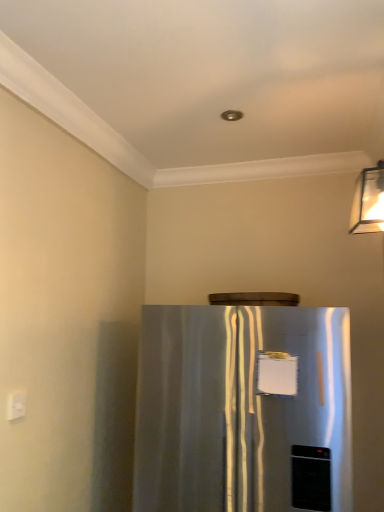
Question: Can you confirm if white plastic electric outlet at lower left is positioned to the left of satin silver refrigerator at center?

Choices:
 (A) no
 (B) yes

Answer: (B)

Question: Is white plastic electric outlet at lower left far from satin silver refrigerator at center?

Choices:
 (A) yes
 (B) no

Answer: (B)

Question: Considering the relative sizes of white plastic electric outlet at lower left and satin silver refrigerator at center in the image provided, is white plastic electric outlet at lower left bigger than satin silver refrigerator at center?

Choices:
 (A) yes
 (B) no

Answer: (B)

Question: Can we say white plastic electric outlet at lower left lies outside satin silver refrigerator at center?

Choices:
 (A) no
 (B) yes

Answer: (B)

Question: Is white plastic electric outlet at lower left shorter than satin silver refrigerator at center?

Choices:
 (A) no
 (B) yes

Answer: (B)

Question: Is satin silver refrigerator at center at the back of white plastic electric outlet at lower left?

Choices:
 (A) yes
 (B) no

Answer: (B)

Question: Does satin silver refrigerator at center touch white plastic electric outlet at lower left?

Choices:
 (A) yes
 (B) no

Answer: (B)

Question: Does satin silver refrigerator at center have a lesser width compared to white plastic electric outlet at lower left?

Choices:
 (A) yes
 (B) no

Answer: (B)

Question: Would you say satin silver refrigerator at center is outside white plastic electric outlet at lower left?

Choices:
 (A) yes
 (B) no

Answer: (A)

Question: Considering the relative sizes of satin silver refrigerator at center and white plastic electric outlet at lower left in the image provided, is satin silver refrigerator at center taller than white plastic electric outlet at lower left?

Choices:
 (A) yes
 (B) no

Answer: (A)

Question: From the image's perspective, is satin silver refrigerator at center on top of white plastic electric outlet at lower left?

Choices:
 (A) yes
 (B) no

Answer: (B)

Question: Could white plastic electric outlet at lower left be considered to be inside satin silver refrigerator at center?

Choices:
 (A) no
 (B) yes

Answer: (A)

Question: Is white plastic electric outlet at lower left in front of or behind satin silver refrigerator at center in the image?

Choices:
 (A) behind
 (B) front

Answer: (A)